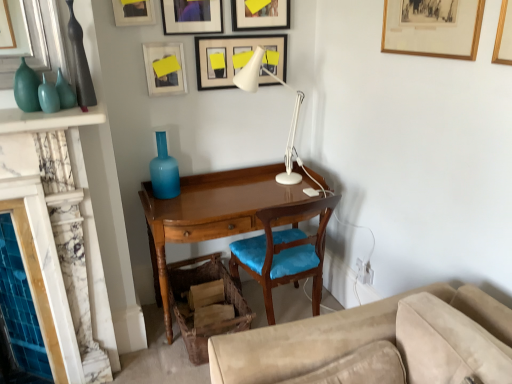
The width and height of the screenshot is (512, 384). What are the coordinates of `white glossy table lamp at center` in the screenshot? It's located at (292, 115).

In order to face white glossy table lamp at center, should I rotate leftwards or rightwards?

Turn right approximately 2.445 degrees to face it.

Identify the location of matte glass vases at left. point(48,96).

Find the location of a particular element. The image size is (512, 384). wooden chair with blue cushion at center is located at coordinates (284, 252).

This screenshot has width=512, height=384. What do you see at coordinates (133, 12) in the screenshot?
I see `wooden picture frame at upper center, acting as the first picture frame starting from the left` at bounding box center [133, 12].

Image resolution: width=512 pixels, height=384 pixels. Identify the location of matte teal glass vase at upper left, the 3th glass vase viewed from the back. (26, 88).

Would you say mahogany wood desk at center contains matte blue glass vase at center, arranged as the first glass vase when viewed from the right?

No, matte blue glass vase at center, arranged as the first glass vase when viewed from the right, is not a part of mahogany wood desk at center.

Is mahogany wood desk at center looking in the opposite direction of matte blue glass vase at center, which is the third glass vase in left-to-right order?

No, mahogany wood desk at center is not facing away from matte blue glass vase at center, which is the third glass vase in left-to-right order.

Is there a large distance between mahogany wood desk at center and matte blue glass vase at center, which is the third glass vase in left-to-right order?

Actually, mahogany wood desk at center and matte blue glass vase at center, which is the third glass vase in left-to-right order, are a little close together.

In order to click on glass vase that is the 1st one when counting forward from the white glossy table lamp at center in this screenshot , I will do `click(65, 92)`.

Which of these two, white glossy table lamp at center or teal glass vase at left, the second glass vase when ordered from left to right, is bigger?

Bigger between the two is white glossy table lamp at center.

Considering the relative sizes of white glossy table lamp at center and teal glass vase at left, the second glass vase when ordered from left to right, in the image provided, is white glossy table lamp at center thinner than teal glass vase at left, the second glass vase when ordered from left to right,?

Incorrect, the width of white glossy table lamp at center is not less than that of teal glass vase at left, the second glass vase when ordered from left to right.

Is point (292, 160) positioned in front of point (66, 97)?

That is False.

From a real-world perspective, is matte glass vases at left over wooden swivel chair at lower center?

Yes.

Does matte glass vases at left touch wooden swivel chair at lower center?

No.

How different are the orientations of matte glass vases at left and wooden swivel chair at lower center in degrees?

matte glass vases at left and wooden swivel chair at lower center are facing 0.704 degrees away from each other.

The image size is (512, 384). I want to click on picture frame that is the 5th one above the wooden chair with blue cushion at center (from a real-world perspective), so click(192, 16).

From the image's perspective, is wooden chair with blue cushion at center located beneath matte black picture frame at upper center, the 3th picture frame positioned from the left?

Yes, from the image's perspective, wooden chair with blue cushion at center is beneath matte black picture frame at upper center, the 3th picture frame positioned from the left.

In the scene shown: Can you tell me how much wooden chair with blue cushion at center and matte black picture frame at upper center, which is the fourth picture frame in right-to-left order, differ in facing direction?

177 degrees.

Is point (255, 259) positioned behind point (214, 7)?

Yes, it is behind point (214, 7).

Which point is more distant from viewer, (x=300, y=217) or (x=42, y=99)?

The point (x=300, y=217) is farther.

Which object is wider, mahogany wood desk at center or matte glass vases at left?

With larger width is mahogany wood desk at center.

In terms of height, does mahogany wood desk at center look taller or shorter compared to matte glass vases at left?

mahogany wood desk at center is taller than matte glass vases at left.

From a real-world perspective, is wooden picture frame at upper center, which is the 2th picture frame from right to left, on top of wooden picture frame at upper center, the 6th picture frame viewed from the right?

No, from a real-world perspective, wooden picture frame at upper center, which is the 2th picture frame from right to left, is not over wooden picture frame at upper center, the 6th picture frame viewed from the right

In the scene shown: Is wooden picture frame at upper center, which is the 2th picture frame from right to left, taller or shorter than wooden picture frame at upper center, acting as the first picture frame starting from the left?

Clearly, wooden picture frame at upper center, which is the 2th picture frame from right to left, is taller compared to wooden picture frame at upper center, acting as the first picture frame starting from the left.

How distant is wooden picture frame at upper center, which is the 5th picture frame in left-to-right order, from wooden picture frame at upper center, acting as the first picture frame starting from the left?

wooden picture frame at upper center, which is the 5th picture frame in left-to-right order, is 21.77 inches from wooden picture frame at upper center, acting as the first picture frame starting from the left.

Find the location of a particular element. Image resolution: width=512 pixels, height=384 pixels. picture frame that is the 3rd one when counting forward from the wooden picture frame at upper center, which is the 2th picture frame from right to left is located at coordinates (133, 12).

From the picture: From a real-world perspective, who is located lower, teal glass vase at left, the second glass vase from the right, or matte black vase at left?

In real-world perspective, teal glass vase at left, the second glass vase from the right, is lower.

Considering the relative positions of teal glass vase at left, the second glass vase from the right, and matte black vase at left in the image provided, is teal glass vase at left, the second glass vase from the right, to the left or to the right of matte black vase at left?

In the image, teal glass vase at left, the second glass vase from the right, appears on the left side of matte black vase at left.

From the picture: Considering the relative sizes of teal glass vase at left, the 2th glass vase when ordered from front to back, and matte black vase at left in the image provided, is teal glass vase at left, the 2th glass vase when ordered from front to back, wider than matte black vase at left?

Yes, teal glass vase at left, the 2th glass vase when ordered from front to back, is wider than matte black vase at left.

Can you confirm if teal glass vase at left, the second glass vase from the right, is taller than matte black vase at left?

Incorrect, the height of teal glass vase at left, the second glass vase from the right, is not larger of that of matte black vase at left.

There is a mahogany wood desk at center. Where is `the 1st glass vase above it (from the image's perspective)`? The image size is (512, 384). the 1st glass vase above it (from the image's perspective) is located at coordinates (164, 171).

Find the location of `glass vase that is the 1st one when counting downward from the white glossy table lamp at center (from the image's perspective)`. glass vase that is the 1st one when counting downward from the white glossy table lamp at center (from the image's perspective) is located at coordinates [65, 92].

Which object lies nearer to the anchor point matte black vase at left, white glossy table lamp at center or beige suede studio couch at lower right?

white glossy table lamp at center lies closer to matte black vase at left than the other object.

From the image, which object appears to be nearer to wooden chair with blue cushion at center, white matte picture frame at upper center, the fourth picture frame in the left-to-right sequence, or wooden swivel chair at lower center?

Based on the image, wooden swivel chair at lower center appears to be nearer to wooden chair with blue cushion at center.

From the image, which object appears to be nearer to wooden framed picture at upper right, the first picture frame viewed from the right, wooden picture frame at upper center, acting as the first picture frame starting from the left, or wooden chair with blue cushion at center?

Based on the image, wooden chair with blue cushion at center appears to be nearer to wooden framed picture at upper right, the first picture frame viewed from the right.

From the image, which object appears to be nearer to wooden framed picture at upper right, the first picture frame viewed from the right, wooden picture frame at upper center, the 6th picture frame viewed from the right, or matte teal glass vase at upper left, the 3th glass vase viewed from the back?

The object closer to wooden framed picture at upper right, the first picture frame viewed from the right, is wooden picture frame at upper center, the 6th picture frame viewed from the right.

Considering their positions, is matte teal glass vase at upper left, the 3th glass vase viewed from the back, positioned further to matte black picture frame at upper center, which is the fourth picture frame in right-to-left order, than white glossy table lamp at center?

matte teal glass vase at upper left, the 3th glass vase viewed from the back, is positioned further to the anchor matte black picture frame at upper center, which is the fourth picture frame in right-to-left order.

Based on their spatial positions, is mahogany wood desk at center or wooden framed picture at upper right, positioned as the 6th picture frame in left-to-right order, closer to wooden swivel chair at lower center?

Based on the image, mahogany wood desk at center appears to be nearer to wooden swivel chair at lower center.

Considering their positions, is matte glass vases at left positioned further to teal glass vase at left, the 2th glass vase when ordered from back to front, than wooden swivel chair at lower center?

wooden swivel chair at lower center.

When comparing their distances from beige suede studio couch at lower right, does wooden picture frame at upper center, the 6th picture frame viewed from the right, or matte black picture frame at upper center, which is the fourth picture frame in right-to-left order, seem closer?

matte black picture frame at upper center, which is the fourth picture frame in right-to-left order, lies closer to beige suede studio couch at lower right than the other object.

Find the location of `turquoise between matte teal glass vase at upper left, placed as the 3th glass vase when sorted from right to left, and wooden swivel chair at lower center in the up-down direction`. turquoise between matte teal glass vase at upper left, placed as the 3th glass vase when sorted from right to left, and wooden swivel chair at lower center in the up-down direction is located at coordinates (48, 96).

I want to click on table lamp between beige suede studio couch at lower right and white matte picture frame at upper center, marked as the 2th picture frame in a left-to-right arrangement, from front to back, so click(292, 115).

Find the location of a particular element. The width and height of the screenshot is (512, 384). bottle situated between matte glass vases at left and wooden picture frame at upper center, which is the 5th picture frame in left-to-right order, from left to right is located at coordinates (80, 64).

Where is `glass vase that lies between matte black picture frame at upper center, which is the fourth picture frame in right-to-left order, and matte teal glass vase at upper left, acting as the first glass vase starting from the left, from top to bottom`? This screenshot has width=512, height=384. glass vase that lies between matte black picture frame at upper center, which is the fourth picture frame in right-to-left order, and matte teal glass vase at upper left, acting as the first glass vase starting from the left, from top to bottom is located at coordinates (65, 92).